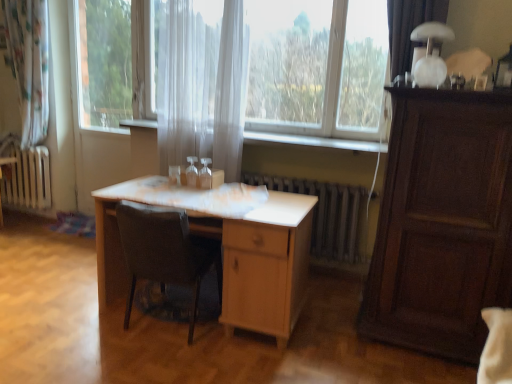
Question: Can you confirm if white glossy table lamp at upper right is bigger than transparent glass screen door at center?

Choices:
 (A) no
 (B) yes

Answer: (A)

Question: From a real-world perspective, is white glossy table lamp at upper right positioned under transparent glass screen door at center based on gravity?

Choices:
 (A) no
 (B) yes

Answer: (A)

Question: Considering the relative positions of white glossy table lamp at upper right and transparent glass screen door at center in the image provided, is white glossy table lamp at upper right in front of transparent glass screen door at center?

Choices:
 (A) yes
 (B) no

Answer: (A)

Question: Can you confirm if white glossy table lamp at upper right is wider than transparent glass screen door at center?

Choices:
 (A) yes
 (B) no

Answer: (A)

Question: From a real-world perspective, is white glossy table lamp at upper right positioned over transparent glass screen door at center based on gravity?

Choices:
 (A) no
 (B) yes

Answer: (B)

Question: From their relative heights in the image, would you say transparent glass screen door at center is taller or shorter than dark wood cabinet at right?

Choices:
 (A) tall
 (B) short

Answer: (A)

Question: From the image's perspective, relative to dark wood cabinet at right, is transparent glass screen door at center above or below?

Choices:
 (A) above
 (B) below

Answer: (A)

Question: Is point (89, 124) positioned closer to the camera than point (390, 167)?

Choices:
 (A) closer
 (B) farther

Answer: (B)

Question: In terms of width, does transparent glass screen door at center look wider or thinner when compared to dark wood cabinet at right?

Choices:
 (A) wide
 (B) thin

Answer: (B)

Question: Visually, is white glossy table lamp at upper right positioned to the left or to the right of transparent fabric at center?

Choices:
 (A) left
 (B) right

Answer: (B)

Question: From the image's perspective, is white glossy table lamp at upper right positioned above or below transparent fabric at center?

Choices:
 (A) below
 (B) above

Answer: (A)

Question: Considering the positions of point (422, 36) and point (121, 99), is point (422, 36) closer or farther from the camera than point (121, 99)?

Choices:
 (A) closer
 (B) farther

Answer: (A)

Question: Which is correct: white glossy table lamp at upper right is inside transparent fabric at center, or outside of it?

Choices:
 (A) outside
 (B) inside

Answer: (A)

Question: Considering the positions of transparent glass screen door at center and dark brown leather chair at center in the image, is transparent glass screen door at center taller or shorter than dark brown leather chair at center?

Choices:
 (A) tall
 (B) short

Answer: (A)

Question: Looking at their shapes, would you say transparent glass screen door at center is wider or thinner than dark brown leather chair at center?

Choices:
 (A) wide
 (B) thin

Answer: (B)